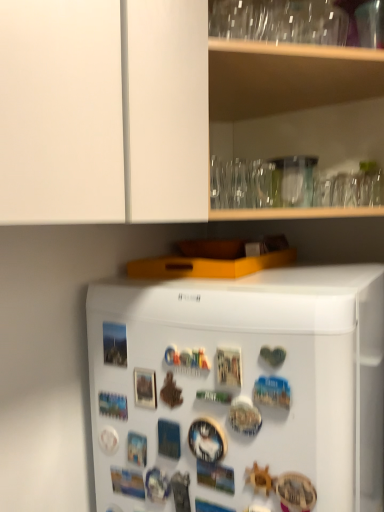
Question: Looking at the image, does white matte refrigerator at center seem bigger or smaller compared to transparent glassware at upper center?

Choices:
 (A) small
 (B) big

Answer: (B)

Question: Would you say white matte refrigerator at center is to the left or to the right of transparent glassware at upper center in the picture?

Choices:
 (A) left
 (B) right

Answer: (A)

Question: From the image's perspective, is white matte refrigerator at center located above or below transparent glassware at upper center?

Choices:
 (A) below
 (B) above

Answer: (A)

Question: From a real-world perspective, is transparent glassware at upper center above or below white matte refrigerator at center?

Choices:
 (A) below
 (B) above

Answer: (B)

Question: Is transparent glassware at upper center bigger or smaller than white matte refrigerator at center?

Choices:
 (A) big
 (B) small

Answer: (B)

Question: In terms of width, does transparent glassware at upper center look wider or thinner when compared to white matte refrigerator at center?

Choices:
 (A) wide
 (B) thin

Answer: (B)

Question: Is transparent glassware at upper center inside the boundaries of white matte refrigerator at center, or outside?

Choices:
 (A) outside
 (B) inside

Answer: (A)